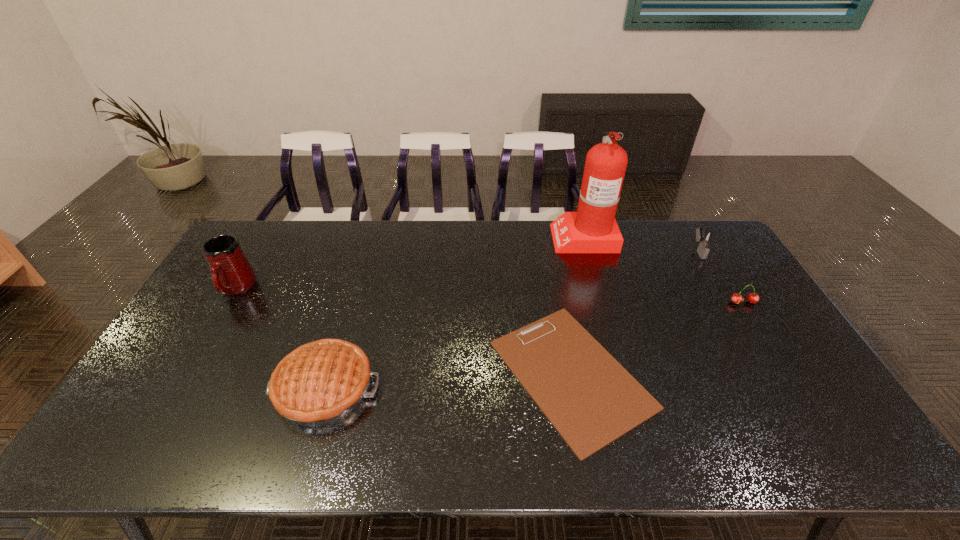
I want to click on free space that satisfies the following two spatial constraints: 1. on the side of the pie with the handle; 2. on the right side of the leftmost object, so tap(177, 389).